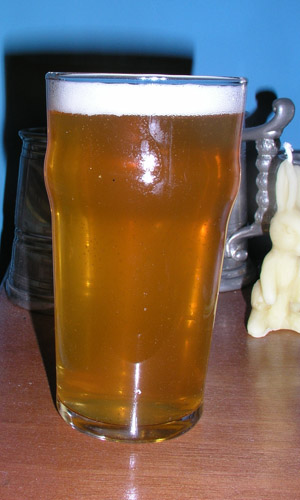
Locate an element on the screen. blue wall in background is located at coordinates (207, 32).